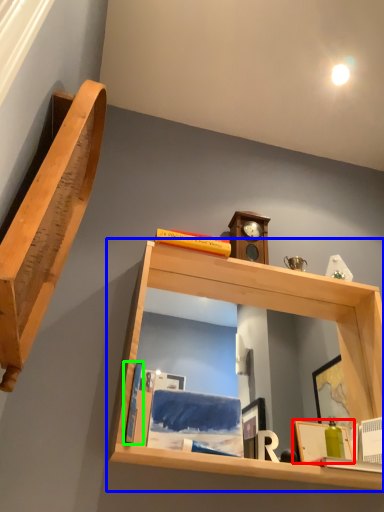
Question: Based on their relative distances, which object is nearer to picture frame (highlighted by a red box)? Choose from shelf (highlighted by a blue box) and book (highlighted by a green box).

Choices:
 (A) shelf
 (B) book

Answer: (A)